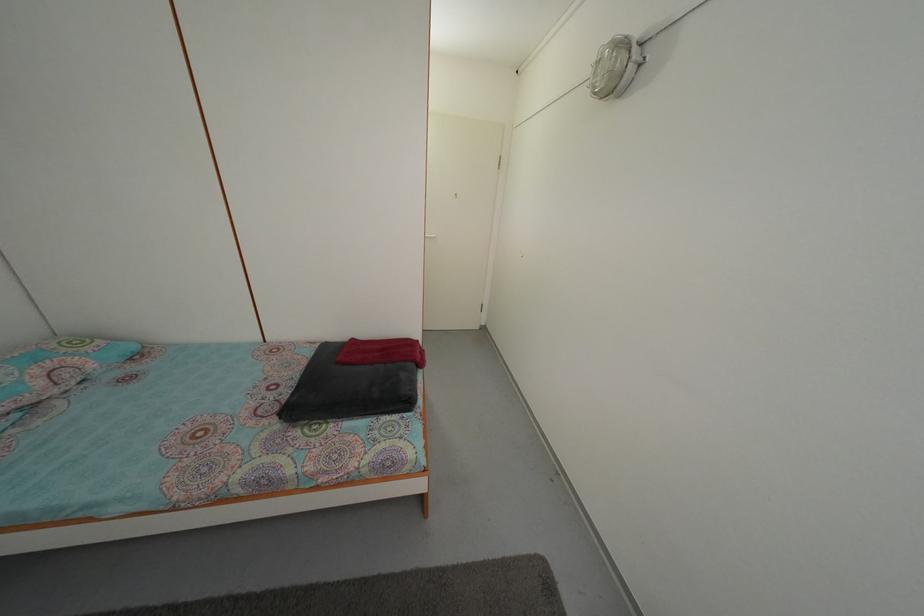
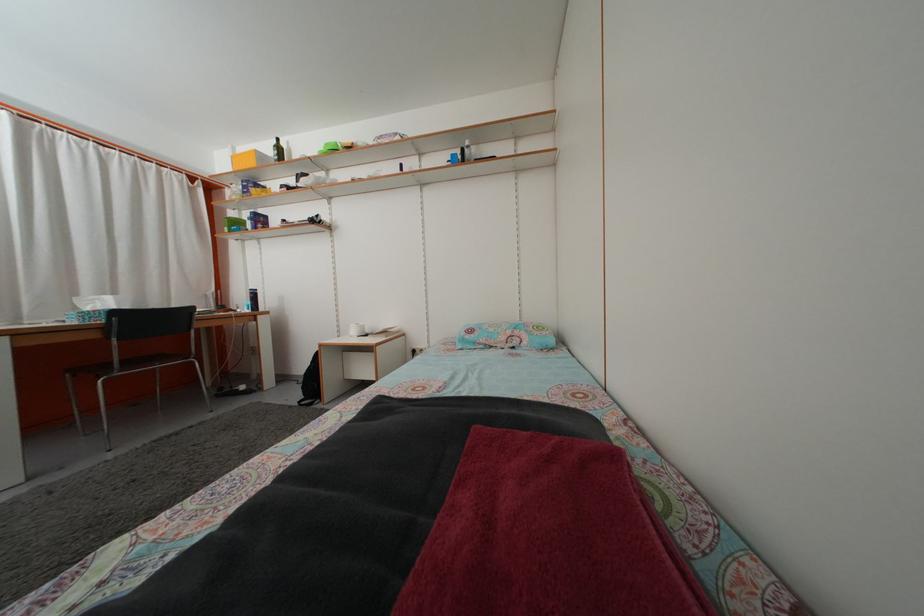
Where in the second image is the point corresponding to pixel 45 390 from the first image?

(508, 346)